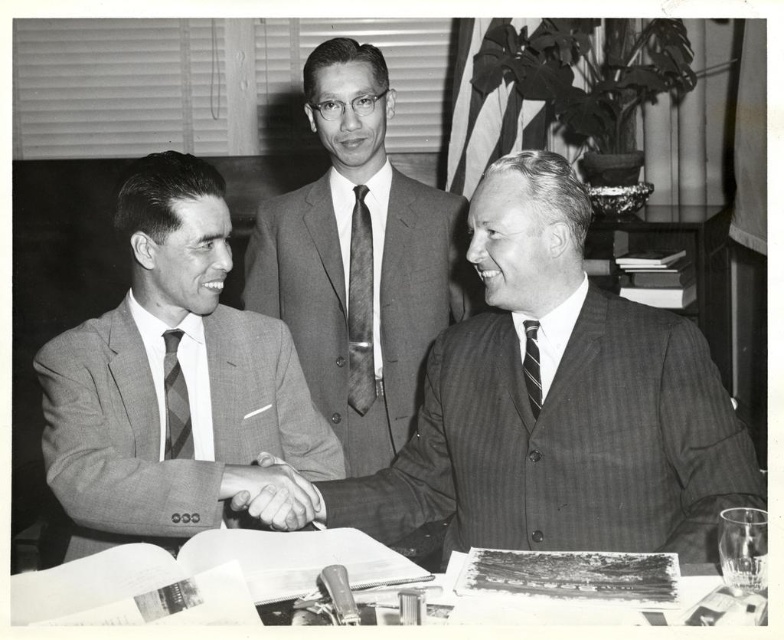
Question: Does pinstriped suit at center appear on the left side of smooth gray suit at center?

Choices:
 (A) yes
 (B) no

Answer: (B)

Question: Among these points, which one is farthest from the camera?

Choices:
 (A) (365, 326)
 (B) (249, 436)

Answer: (A)

Question: Which of the following is the farthest from the observer?

Choices:
 (A) (167, 378)
 (B) (180, 163)
 (C) (514, 502)
 (D) (368, 253)

Answer: (D)

Question: Based on their relative distances, which object is nearer to the gray textured suit at left?

Choices:
 (A) pinstriped suit at center
 (B) smooth gray suit at center
 (C) gray striped tie at left
 (D) textured gray tie at center

Answer: (C)

Question: Is smooth gray suit at center wider than textured gray tie at center?

Choices:
 (A) yes
 (B) no

Answer: (A)

Question: Does gray textured suit at left have a lesser width compared to smooth gray suit at center?

Choices:
 (A) no
 (B) yes

Answer: (B)